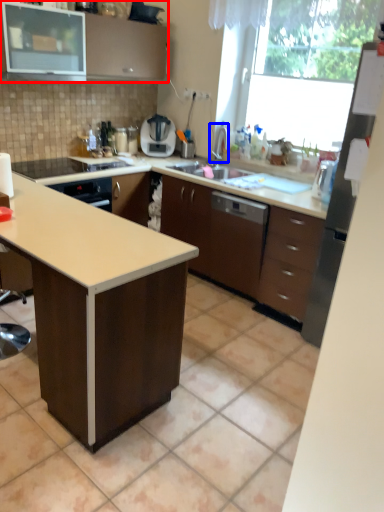
Question: Which object appears farthest to the camera in this image, cabinetry (highlighted by a red box) or faucet (highlighted by a blue box)?

Choices:
 (A) cabinetry
 (B) faucet

Answer: (B)